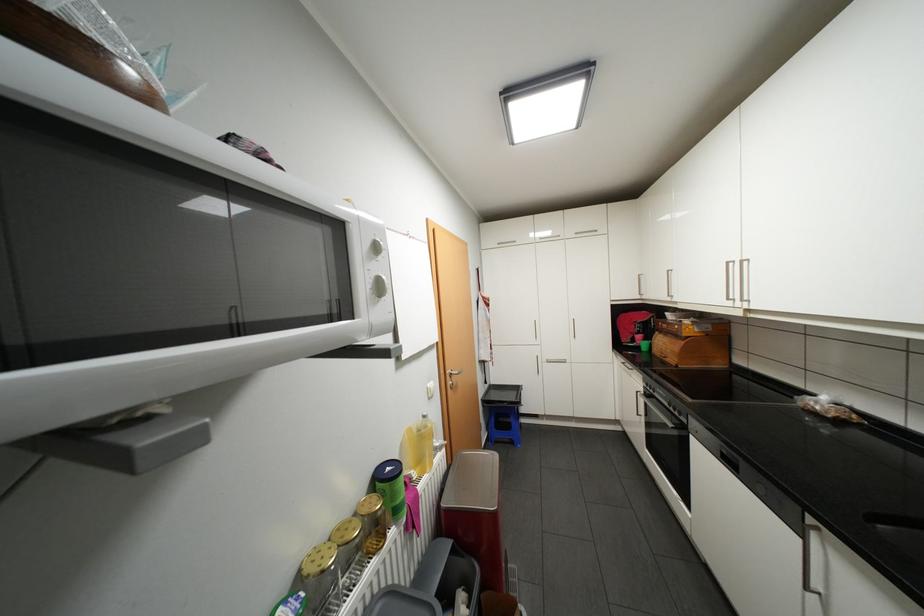
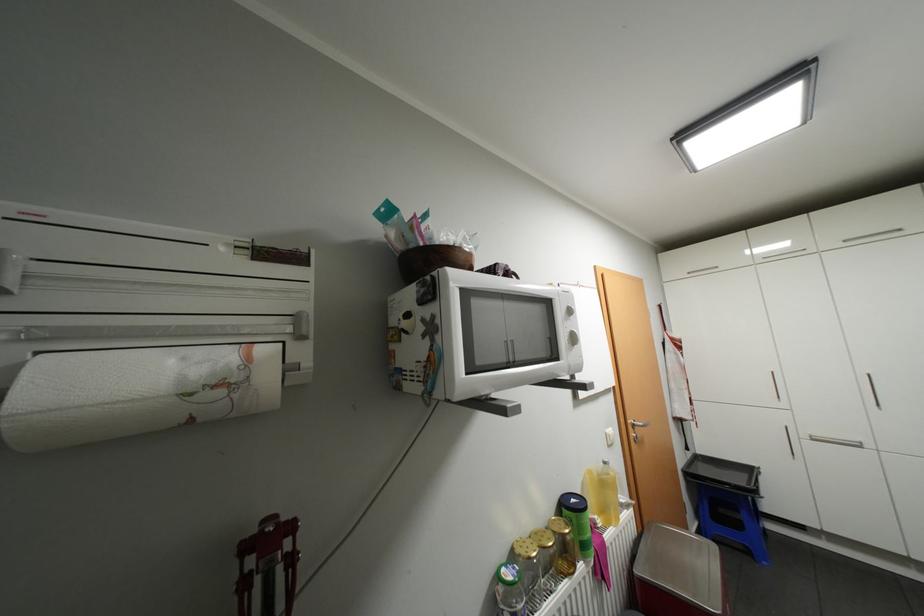
Find the pixel in the second image that matches point (456, 511) in the first image.

(652, 583)